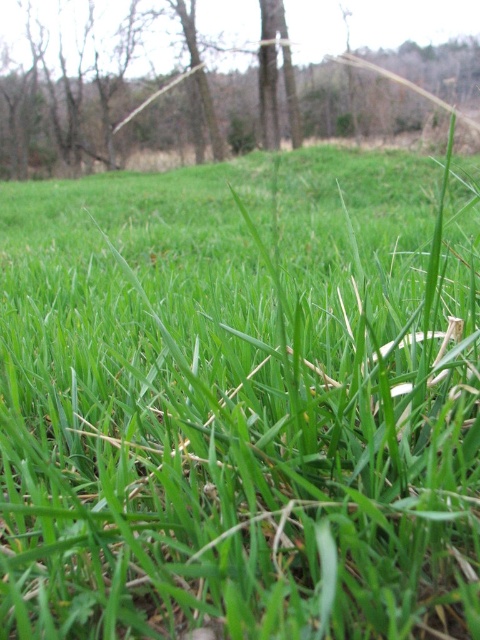
You are a photographer adjusting your camera settings to focus on two points in the grassy area. The first point is labeled as point (312, 17) and the second as point (269, 54). Based on the scene, which point should you focus on to ensure the foreground grass blades are sharp?

You should focus on point (312, 17) because it is closer to the camera, ensuring the foreground grass blades remain sharp.

You are a photographer trying to capture the brown wood tree at center and the smooth brown tree trunk at center in your shot. Based on the scene, which of these two objects is positioned higher in the frame?

The brown wood tree at center is positioned higher in the frame than the smooth brown tree trunk at center because it is located above it.

You are a photographer standing at the camera position. You want to take a photo of the brown wood tree at center. The camera has a focal length of 50mm and an aperture of f2.8. To ensure the tree is in focus, what should you adjust if the current focus distance is set to 50 feet?

The brown wood tree at center is 51.04 feet from the camera. Since the current focus distance is set to 50 feet, which is slightly shorter than the actual distance, you should adjust the focus distance to 51.04 feet to ensure the tree is in focus.